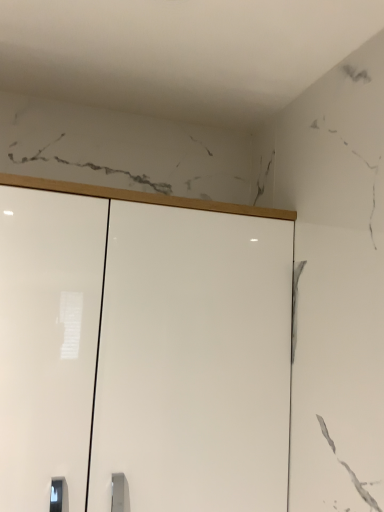
Question: Should I look upward or downward to see glossy white cupboard at center?

Choices:
 (A) down
 (B) up

Answer: (A)